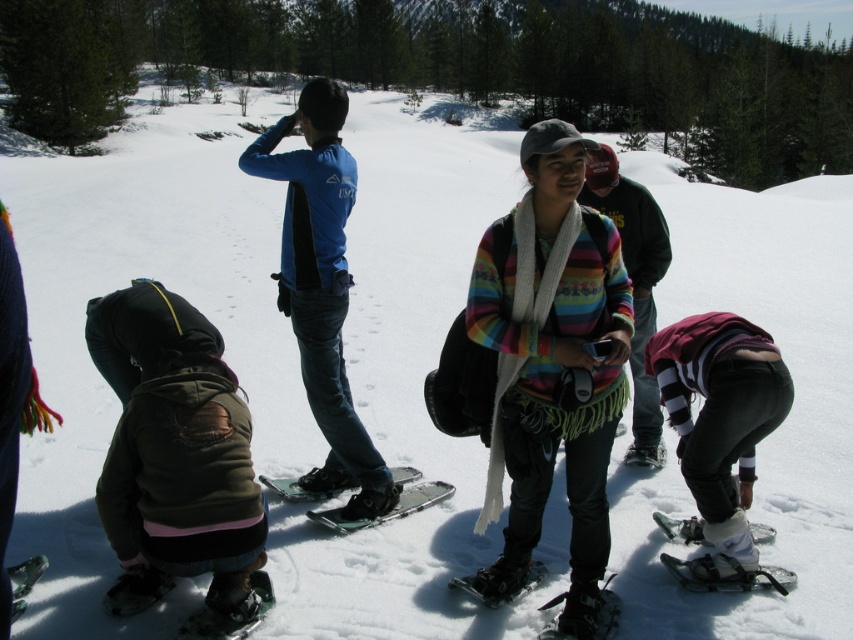
You are a photographer standing at the edge of the snowy area. You want to take a photo that includes both the point at (556, 595) and the point at (247, 618). Which point should you focus on first to ensure both are in sharp focus?

You should focus on the point at (247, 618) first because it is closer to you than the point at (556, 595). By focusing on the closer point, the further point will also be within the depth of field, ensuring both are in sharp focus.

You are a snowshoeing enthusiast who wants to ensure your gear is properly arranged before starting your hike. You have a black rubber snowshoe at lower center and a green matte ski at lower left. Which gear is placed underneath the other?

The black rubber snowshoe at lower center is positioned under the green matte ski at lower left.

You are a snowshoeing instructor and need to choose between the green metallic ski at center and the green rubber snowshoe at lower left for a beginner class. Which one is more suitable for distributing weight to prevent sinking into the snow?

The green rubber snowshoe at lower left is more suitable because it is smaller than the green metallic ski at center, allowing for better weight distribution over a larger area to prevent sinking into the snow.